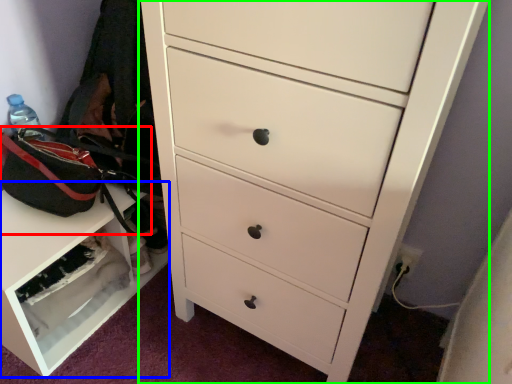
Question: Estimate the real-world distances between objects in this image. Which object is farther from messenger bag (highlighted by a red box), cabinetry (highlighted by a blue box) or chest of drawers (highlighted by a green box)?

Choices:
 (A) cabinetry
 (B) chest of drawers

Answer: (B)